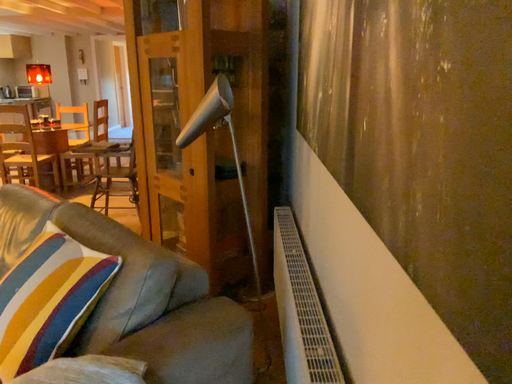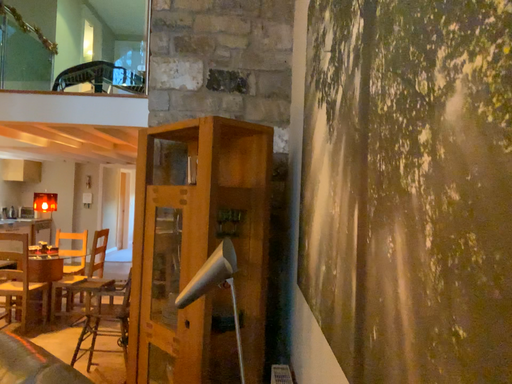
Question: Which way did the camera rotate in the video?

Choices:
 (A) rotated downward
 (B) rotated upward

Answer: (B)